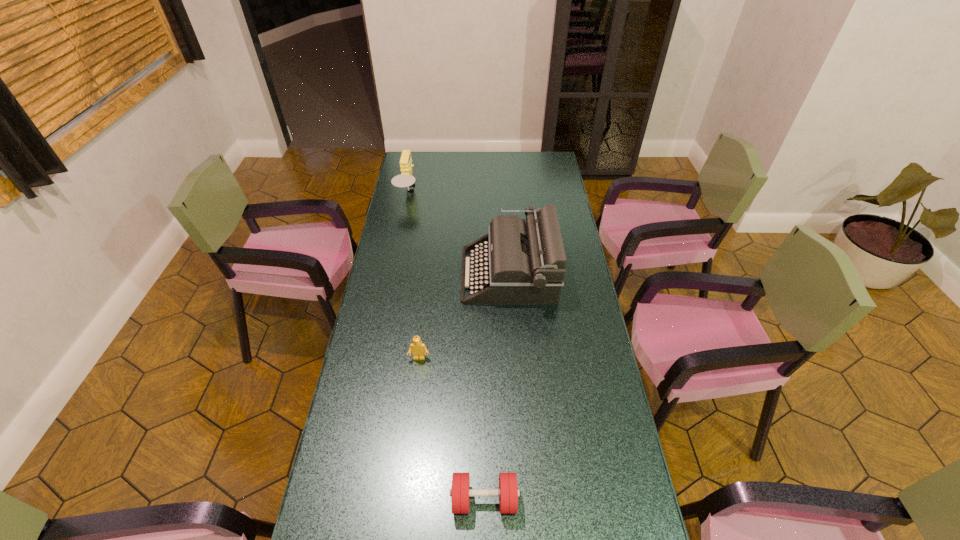
Locate an element on the screen. The height and width of the screenshot is (540, 960). free location that satisfies the following two spatial constraints: 1. on the face of the third farthest object; 2. on the left side of the dumbbell is located at coordinates (402, 500).

Where is `vacant point that satisfies the following two spatial constraints: 1. on the typing side of the typewriter; 2. on the face of the Lego`? This screenshot has width=960, height=540. vacant point that satisfies the following two spatial constraints: 1. on the typing side of the typewriter; 2. on the face of the Lego is located at coordinates (514, 358).

I want to click on free space that satisfies the following two spatial constraints: 1. on the front-facing side of the sponge; 2. on the right side of the dumbbell, so click(348, 500).

The height and width of the screenshot is (540, 960). Find the location of `free point that satisfies the following two spatial constraints: 1. on the face of the second nearest object; 2. on the left side of the dumbbell`. free point that satisfies the following two spatial constraints: 1. on the face of the second nearest object; 2. on the left side of the dumbbell is located at coordinates click(402, 500).

Locate an element on the screen. free space that satisfies the following two spatial constraints: 1. on the face of the dumbbell; 2. on the left side of the third farthest object is located at coordinates (402, 500).

The width and height of the screenshot is (960, 540). I want to click on free spot that satisfies the following two spatial constraints: 1. on the face of the nearest object; 2. on the left side of the third farthest object, so click(402, 500).